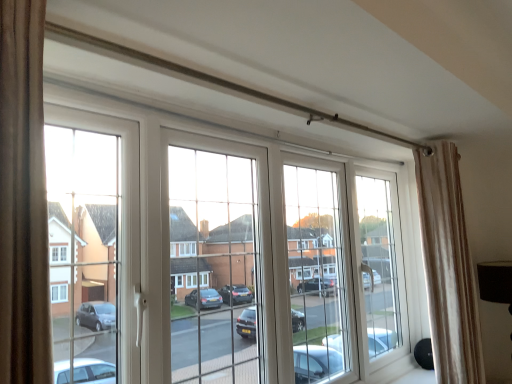
Question: Is beige striped curtain at right surrounding white plastic window at center?

Choices:
 (A) yes
 (B) no

Answer: (B)

Question: Considering the relative sizes of beige striped curtain at right and white plastic window at center in the image provided, is beige striped curtain at right smaller than white plastic window at center?

Choices:
 (A) yes
 (B) no

Answer: (A)

Question: From the image's perspective, is beige striped curtain at right above white plastic window at center?

Choices:
 (A) no
 (B) yes

Answer: (A)

Question: From the image's perspective, is beige striped curtain at right located beneath white plastic window at center?

Choices:
 (A) no
 (B) yes

Answer: (B)

Question: From a real-world perspective, is beige striped curtain at right located higher than white plastic window at center?

Choices:
 (A) yes
 (B) no

Answer: (B)

Question: Is beige striped curtain at right beside white plastic window at center?

Choices:
 (A) no
 (B) yes

Answer: (A)

Question: Does white plastic window at center appear on the right side of beige striped curtain at right?

Choices:
 (A) yes
 (B) no

Answer: (B)

Question: From a real-world perspective, is white plastic window at center positioned over beige striped curtain at right based on gravity?

Choices:
 (A) no
 (B) yes

Answer: (B)

Question: Considering the relative sizes of white plastic window at center and beige striped curtain at right in the image provided, is white plastic window at center shorter than beige striped curtain at right?

Choices:
 (A) yes
 (B) no

Answer: (A)

Question: Is the depth of white plastic window at center greater than that of beige striped curtain at right?

Choices:
 (A) yes
 (B) no

Answer: (B)

Question: Is white plastic window at center at the left side of beige striped curtain at right?

Choices:
 (A) no
 (B) yes

Answer: (B)

Question: Considering the relative sizes of white plastic window at center and beige striped curtain at right in the image provided, is white plastic window at center thinner than beige striped curtain at right?

Choices:
 (A) yes
 (B) no

Answer: (A)

Question: From the image's perspective, is beige striped curtain at right positioned above or below white plastic window at center?

Choices:
 (A) below
 (B) above

Answer: (A)